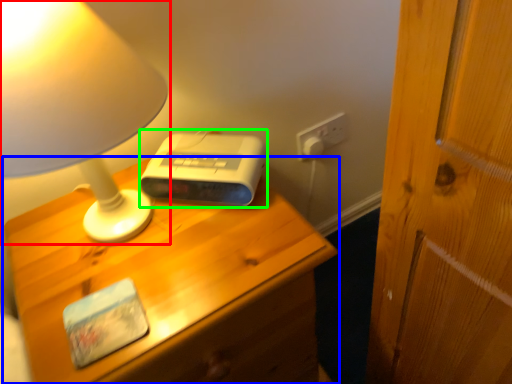
Question: Based on their relative distances, which object is nearer to lamp (highlighted by a red box)? Choose from nightstand (highlighted by a blue box) and gadget (highlighted by a green box).

Choices:
 (A) nightstand
 (B) gadget

Answer: (B)